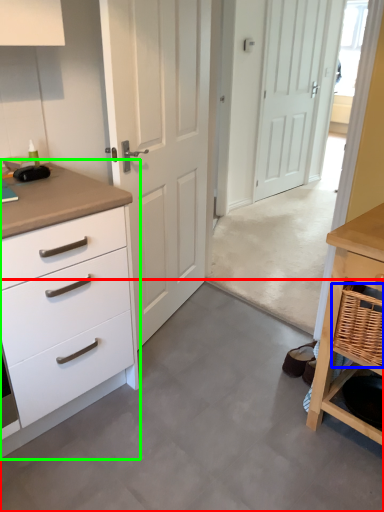
Question: Which object is the closest to the concrete (highlighted by a red box)? Choose among these: basket (highlighted by a blue box) or chest of drawers (highlighted by a green box).

Choices:
 (A) basket
 (B) chest of drawers

Answer: (B)